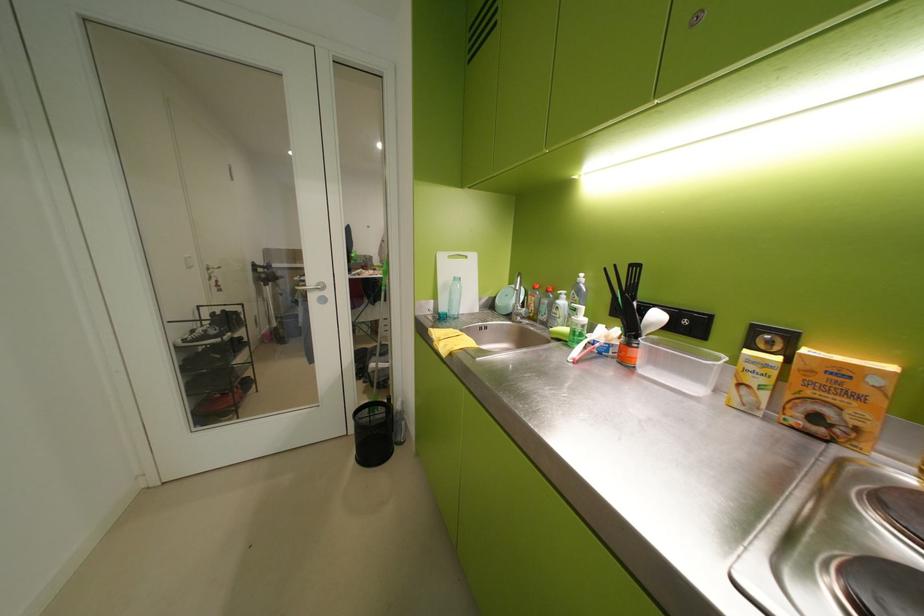
You are a GUI agent. You are given a task and a screenshot of the screen. Output one action in this format:
    pyautogui.click(x=<x>, y=<y>)
    Task: Click on the yellow salt box
    This screenshot has height=616, width=924.
    Given the screenshot: What is the action you would take?
    pyautogui.click(x=752, y=382)